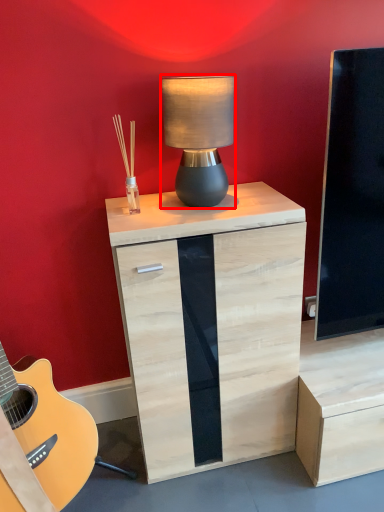
Question: Observing the image, what is the correct spatial positioning of lamp (annotated by the red box) in reference to chest of drawers?

Choices:
 (A) right
 (B) left

Answer: (B)